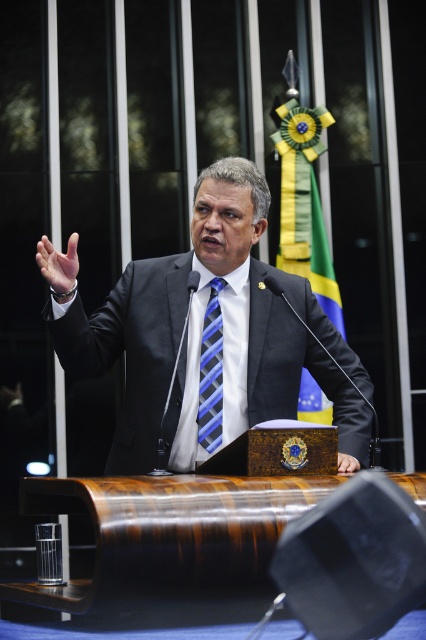
Question: Estimate the real-world distances between objects in this image. Which object is closer to the matte blue tie at center?

Choices:
 (A) smooth skin hand at center
 (B) black suit at center
 (C) blue striped tie at center

Answer: (B)

Question: Is black suit at center to the left of smooth skin hand at center from the viewer's perspective?

Choices:
 (A) no
 (B) yes

Answer: (B)

Question: Which point is farther from the camera taking this photo?

Choices:
 (A) (215, 316)
 (B) (250, 189)
 (C) (48, 246)

Answer: (A)

Question: Which point appears farthest from the camera in this image?

Choices:
 (A) (354, 465)
 (B) (213, 408)
 (C) (46, 252)
 (D) (342, 348)

Answer: (D)

Question: Considering the relative positions of blue striped tie at center and matte blue tie at center in the image provided, where is blue striped tie at center located with respect to matte blue tie at center?

Choices:
 (A) below
 (B) above

Answer: (A)

Question: Is blue striped tie at center above smooth skin hand at center?

Choices:
 (A) no
 (B) yes

Answer: (B)